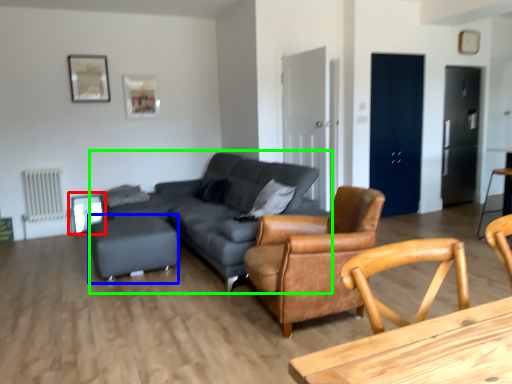
Question: Which object is the farthest from side table (highlighted by a red box)? Choose among these: bar stool (highlighted by a blue box) or studio couch (highlighted by a green box).

Choices:
 (A) bar stool
 (B) studio couch

Answer: (B)